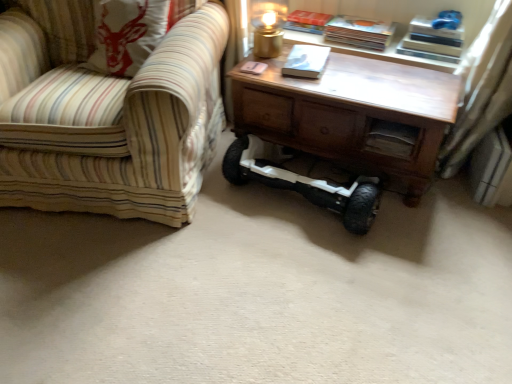
Locate an element on the screen. This screenshot has height=384, width=512. free point in front of white matte hoverboard at center is located at coordinates (304, 281).